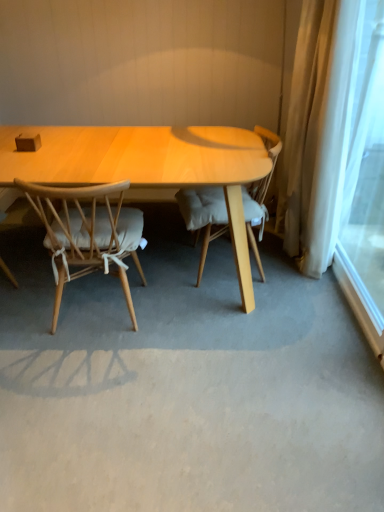
Question: From a real-world perspective, is light wood chair with cushion at left, which is counted as the 1th chair, starting from the left, positioned above or below light brown wood chair at center, marked as the 1th chair in a right-to-left arrangement?

Choices:
 (A) below
 (B) above

Answer: (A)

Question: From the image's perspective, is light wood chair with cushion at left, which is counted as the 1th chair, starting from the left, positioned above or below light brown wood chair at center, marked as the 1th chair in a right-to-left arrangement?

Choices:
 (A) above
 (B) below

Answer: (B)

Question: Which of these objects is positioned farthest from the light brown wood chair at center, marked as the 1th chair in a right-to-left arrangement?

Choices:
 (A) light wood chair with cushion at left, which is counted as the 1th chair, starting from the left
 (B) white sheer curtain at right

Answer: (B)

Question: Estimate the real-world distances between objects in this image. Which object is closer to the light wood chair with cushion at left, which is counted as the 1th chair, starting from the left?

Choices:
 (A) white sheer curtain at right
 (B) light brown wood chair at center, the 2th chair positioned from the left

Answer: (B)